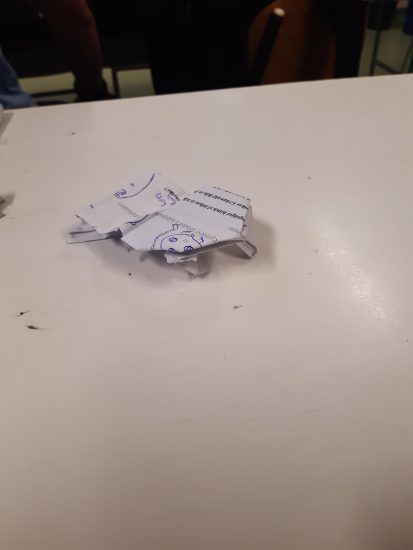
Where is `wall`? The image size is (413, 550). wall is located at coordinates (401, 45).